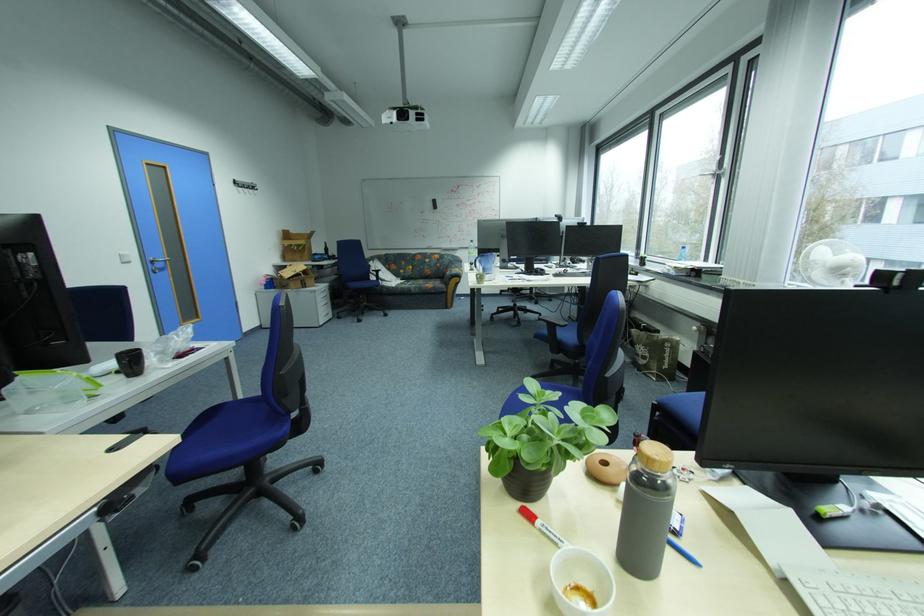
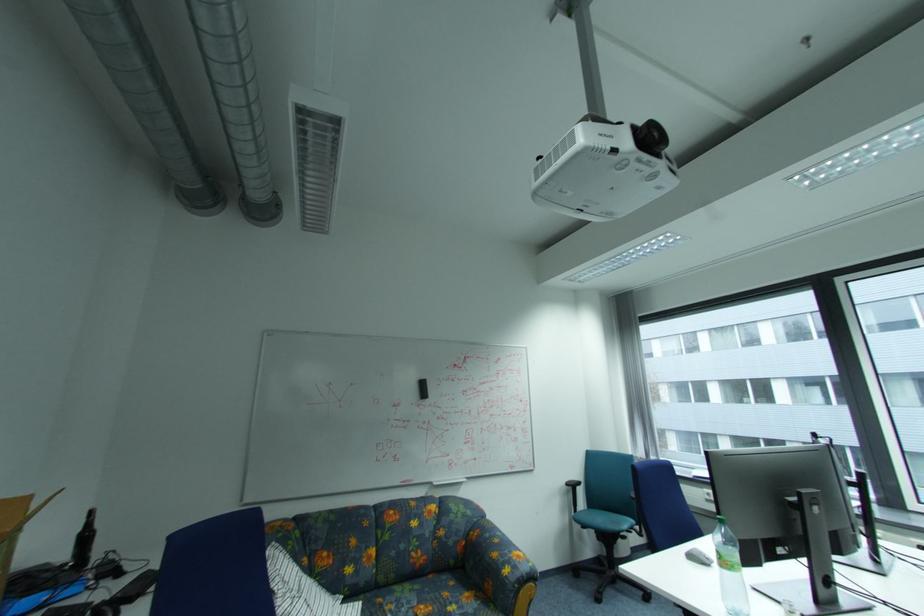
In the second image, find the point that corresponds to point 456,274 in the first image.

(515, 572)